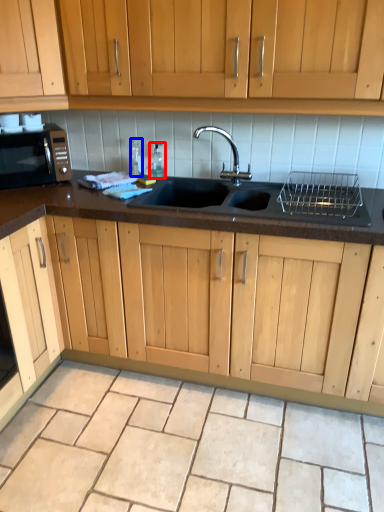
Question: Which of the following is the closest to the observer, bottle (highlighted by a red box) or bottle (highlighted by a blue box)?

Choices:
 (A) bottle
 (B) bottle

Answer: (B)